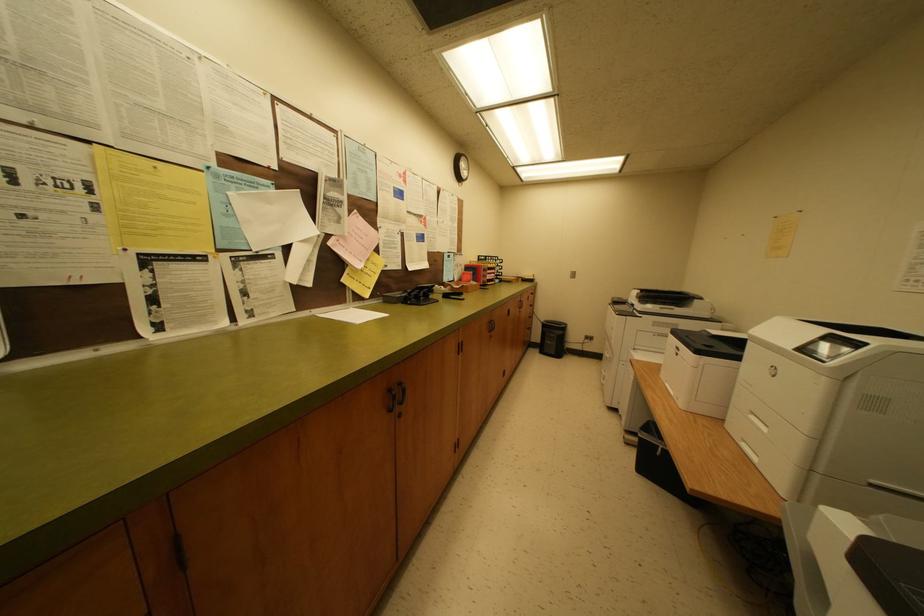
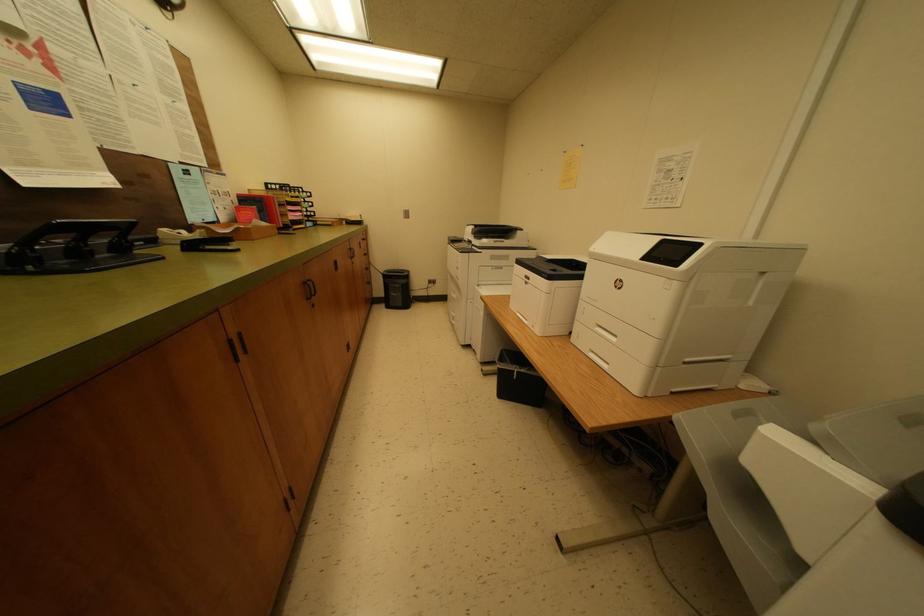
Question: The camera is either moving clockwise (left) or counter-clockwise (right) around the object. The first image is from the beginning of the video and the second image is from the end. Is the camera moving left or right when shooting the video?

Choices:
 (A) Left
 (B) Right

Answer: (A)